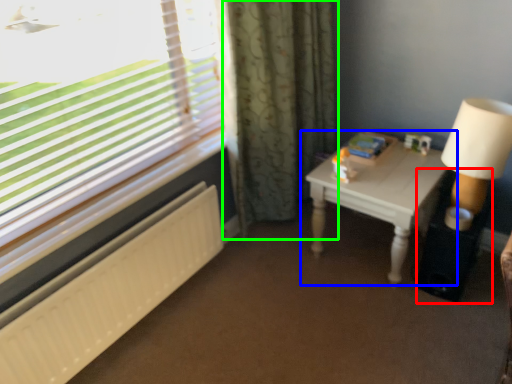
Question: Considering the real-world distances, which object is closest to side table (highlighted by a red box)? table (highlighted by a blue box) or curtain (highlighted by a green box).

Choices:
 (A) table
 (B) curtain

Answer: (A)